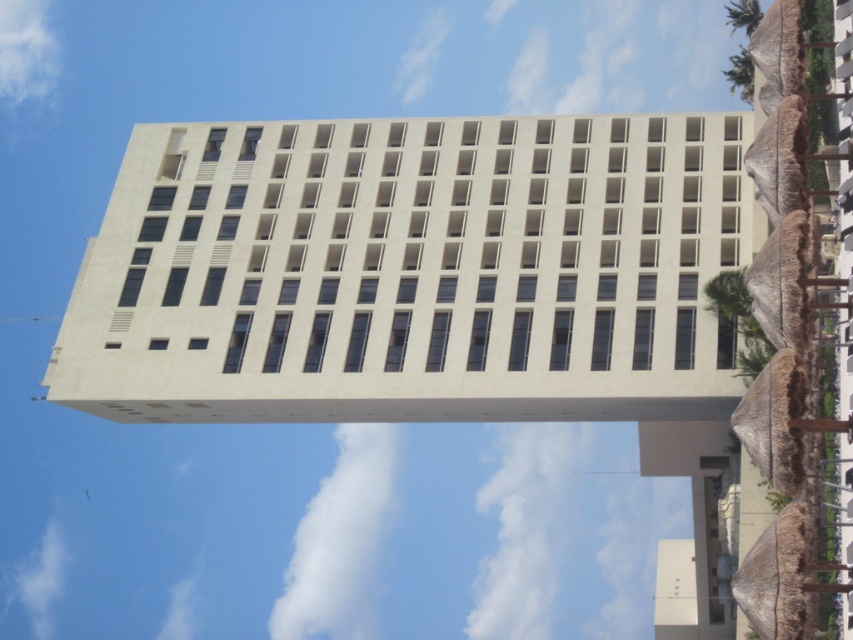
You are standing at the center of the beach and see the point marked at coordinates (410, 273). What object is located at that point?

The beige concrete building at center is located at point (410, 273).

You are standing at the beach and want to take a photo of the beige concrete building at center and the white fluffy cloud at upper center together in the frame. Which object should you zoom out more to include both in the photo?

You should zoom out more to include both the beige concrete building at center and the white fluffy cloud at upper center because the beige concrete building at center is wider than the white fluffy cloud at upper center.

From the picture: You are standing at the beach looking at the building. There are two points marked on the building. One is at coordinate point (608, 314) and the other is at point (740, 70). Which point is closer to you?

Point (608, 314) is closer to the viewer than point (740, 70).